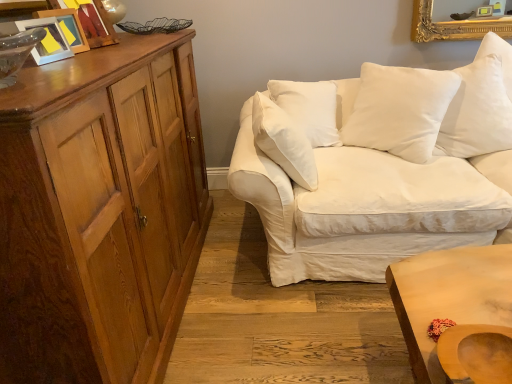
Question: Is wooden swivel chair at lower right to the left of white cotton pillow at upper right, placed as the 1th pillow when sorted from right to left, from the viewer's perspective?

Choices:
 (A) yes
 (B) no

Answer: (A)

Question: Does wooden swivel chair at lower right appear on the right side of white cotton pillow at upper right, placed as the 1th pillow when sorted from right to left?

Choices:
 (A) no
 (B) yes

Answer: (A)

Question: From a real-world perspective, is wooden swivel chair at lower right located higher than white cotton pillow at upper right, placed as the 1th pillow when sorted from right to left?

Choices:
 (A) yes
 (B) no

Answer: (B)

Question: Is white cotton pillow at upper right, placed as the 1th pillow when sorted from right to left, completely or partially inside wooden swivel chair at lower right?

Choices:
 (A) yes
 (B) no

Answer: (B)

Question: From the image's perspective, is wooden swivel chair at lower right on top of white cotton pillow at upper right, the 2th pillow viewed from the left?

Choices:
 (A) no
 (B) yes

Answer: (A)

Question: Is point (437, 104) positioned closer to the camera than point (345, 276)?

Choices:
 (A) farther
 (B) closer

Answer: (A)

Question: Considering the relative positions of white cotton pillow at upper right, arranged as the 1th pillow when viewed from the left, and white cotton couch at right in the image provided, is white cotton pillow at upper right, arranged as the 1th pillow when viewed from the left, to the left or to the right of white cotton couch at right?

Choices:
 (A) left
 (B) right

Answer: (A)

Question: In terms of size, does white cotton pillow at upper right, marked as the second pillow in a right-to-left arrangement, appear bigger or smaller than white cotton couch at right?

Choices:
 (A) big
 (B) small

Answer: (B)

Question: In terms of width, does white cotton pillow at upper right, arranged as the 1th pillow when viewed from the left, look wider or thinner when compared to white cotton couch at right?

Choices:
 (A) wide
 (B) thin

Answer: (B)

Question: Is matte plastic picture frame at upper left, arranged as the first picture frame when viewed from the front, taller or shorter than white cotton pillow at upper right, placed as the 1th pillow when sorted from right to left?

Choices:
 (A) tall
 (B) short

Answer: (B)

Question: In terms of width, does matte plastic picture frame at upper left, the 3th picture frame viewed from the back, look wider or thinner when compared to white cotton pillow at upper right, the 2th pillow viewed from the left?

Choices:
 (A) thin
 (B) wide

Answer: (A)

Question: From a real-world perspective, is matte plastic picture frame at upper left, the 3th picture frame viewed from the back, physically located above or below white cotton pillow at upper right, the 2th pillow viewed from the left?

Choices:
 (A) above
 (B) below

Answer: (A)

Question: Relative to white cotton pillow at upper right, the 2th pillow viewed from the left, is matte plastic picture frame at upper left, the 3th picture frame viewed from the back, in front or behind?

Choices:
 (A) behind
 (B) front

Answer: (B)

Question: Based on their positions, is white cotton couch at right located to the left or right of white cotton pillow at upper right, the 2th pillow viewed from the left?

Choices:
 (A) left
 (B) right

Answer: (A)

Question: Choose the correct answer: Is white cotton couch at right inside white cotton pillow at upper right, the 2th pillow viewed from the left, or outside it?

Choices:
 (A) inside
 (B) outside

Answer: (B)